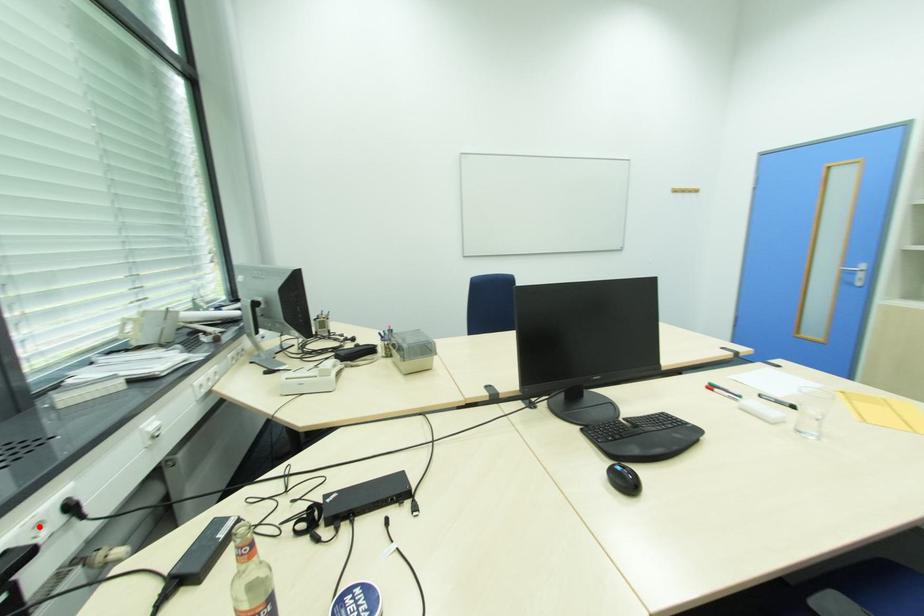
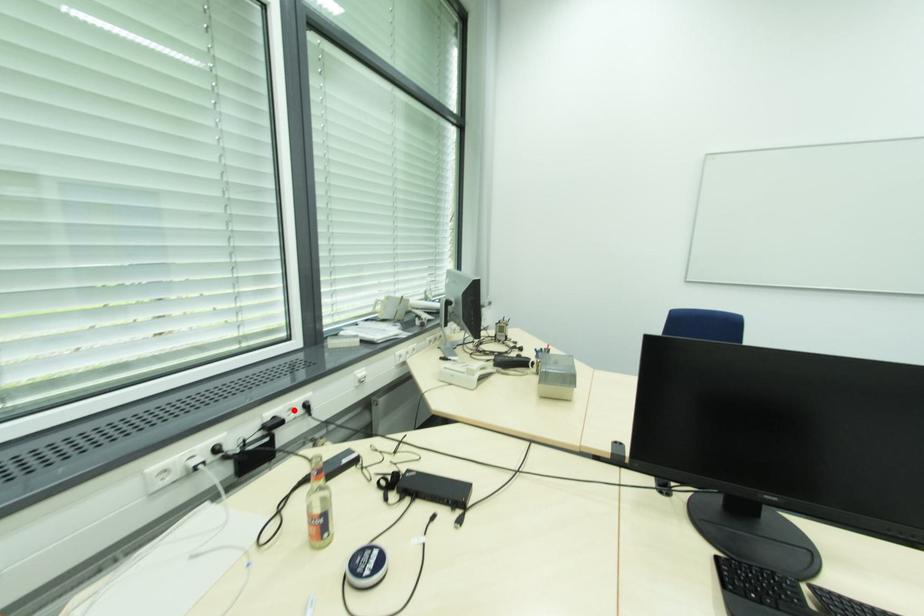
I am providing you with two images of the same scene from different viewpoints. A red point is marked on the first image and another point is marked on the second image. Does the point marked in image1 correspond to the same location as the one in image2?

Yes